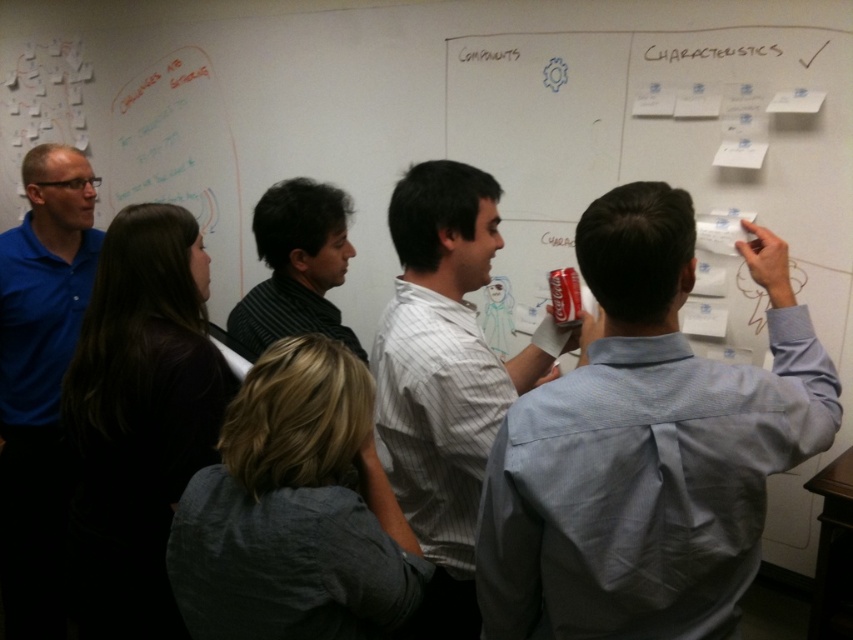
You are standing in front of the whiteboard and notice two points marked on it. The first point is at coordinates point [395,584] and the second is at point [202,394]. Which of these points appears closer to you?

Point [395,584] is closer to the camera than point [202,394], so it appears closer to you.

Based on the photo, based on the scene description, what is the exact location of the white striped shirt at center?

The white striped shirt at center is located at point (444, 376).